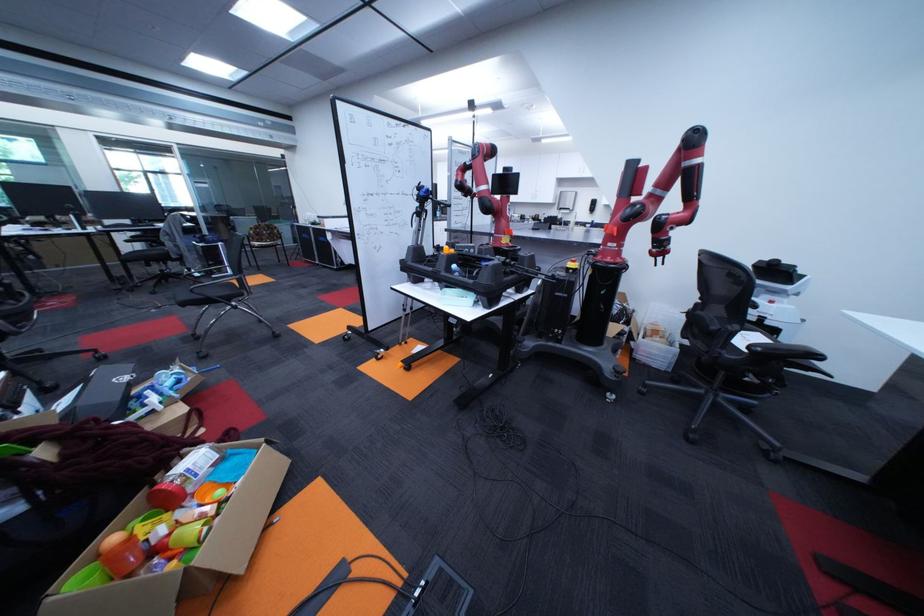
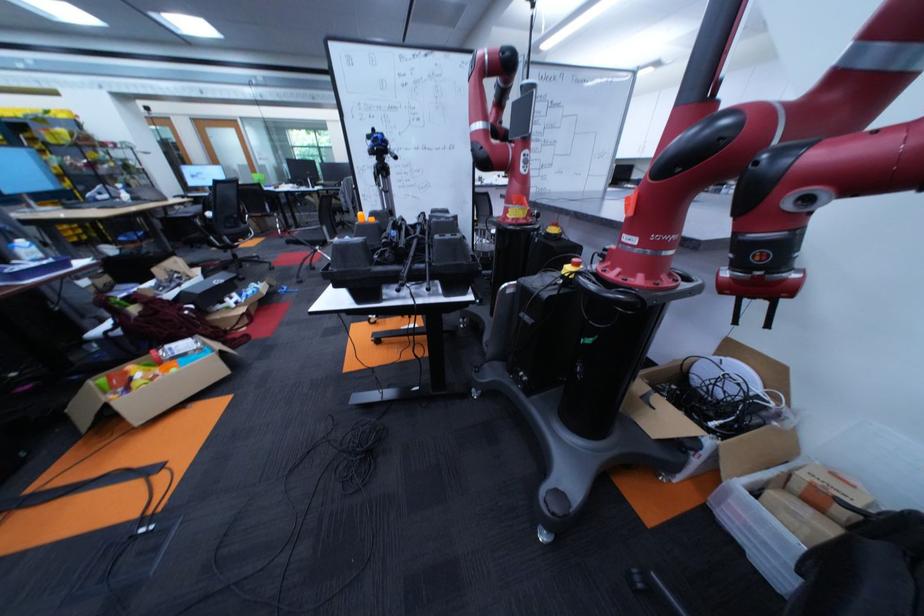
Locate, in the second image, the point that corresponds to (x=178, y=390) in the first image.

(258, 296)